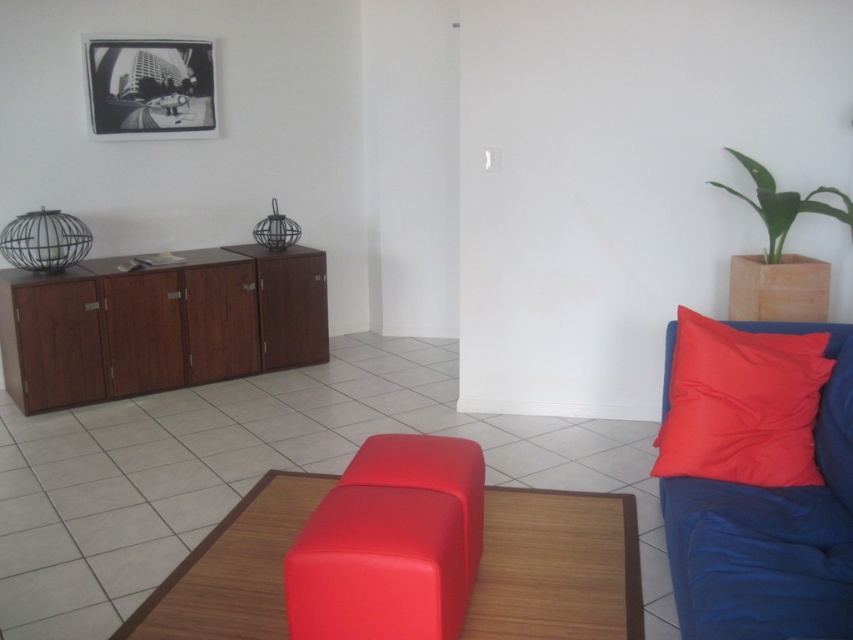
Question: Which of the following is the farthest from the observer?

Choices:
 (A) matte red stool at center
 (B) matte red ottoman at center
 (C) matte red pillow at right
 (D) black glossy picture frame at upper left

Answer: (D)

Question: Which of the following is the closest to the observer?

Choices:
 (A) (271, 566)
 (B) (48, 385)

Answer: (A)

Question: Is the position of matte red ottoman at center less distant than that of matte red stool at center?

Choices:
 (A) no
 (B) yes

Answer: (A)

Question: Which object is positioned farthest from the matte red ottoman at center?

Choices:
 (A) matte red stool at center
 (B) black glossy picture frame at upper left
 (C) wooden cabinet at left

Answer: (B)

Question: Can you confirm if matte red ottoman at center is positioned above black glossy picture frame at upper left?

Choices:
 (A) yes
 (B) no

Answer: (B)

Question: Can you confirm if wooden cabinet at left is positioned to the right of matte red stool at center?

Choices:
 (A) yes
 (B) no

Answer: (B)